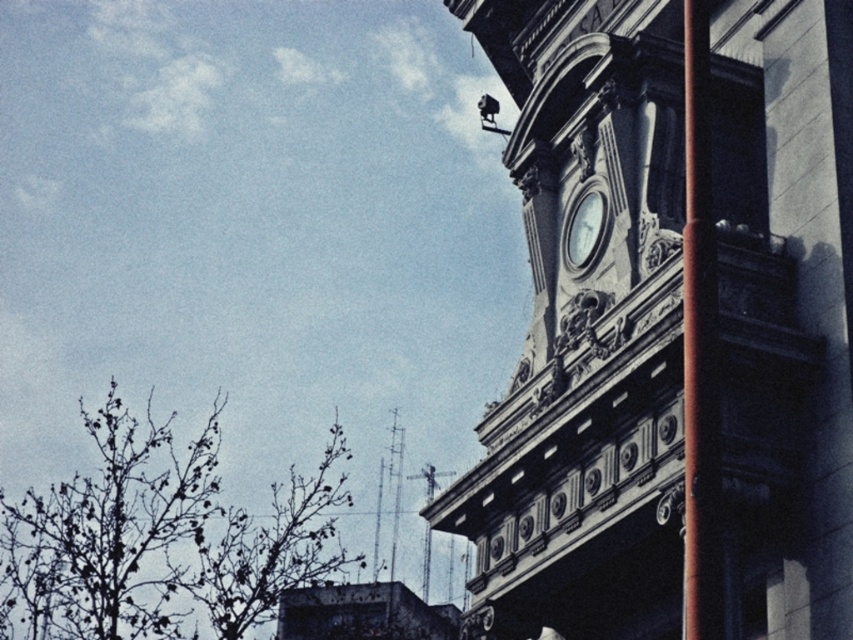
Which is behind, point (277, 484) or point (699, 436)?

The point (277, 484) is behind.

From the picture: Is bare branches at lower left thinner than smooth brown pole at right?

No, bare branches at lower left is not thinner than smooth brown pole at right.

Which is in front, point (196, 442) or point (694, 205)?

Point (694, 205) is more forward.

Image resolution: width=853 pixels, height=640 pixels. I want to click on bare branches at lower left, so click(161, 538).

Can you confirm if bare branches at lower left is taller than white glossy clock at upper center?

Correct, bare branches at lower left is much taller as white glossy clock at upper center.

From the picture: Who is higher up, bare branches at lower left or white glossy clock at upper center?

white glossy clock at upper center is higher up.

At what (x,y) coordinates should I click in order to perform the action: click on bare branches at lower left. Please return your answer as a coordinate pair (x, y). Image resolution: width=853 pixels, height=640 pixels. Looking at the image, I should click on (161, 538).

Is smooth brown pole at right thinner than white glossy clock at upper center?

In fact, smooth brown pole at right might be wider than white glossy clock at upper center.

Measure the distance between point (712, 460) and camera.

Point (712, 460) is 42.89 meters away from camera.

Who is more distant from viewer, (686,556) or (596,244)?

Positioned behind is point (596,244).

Locate an element on the screen. The image size is (853, 640). smooth brown pole at right is located at coordinates (699, 348).